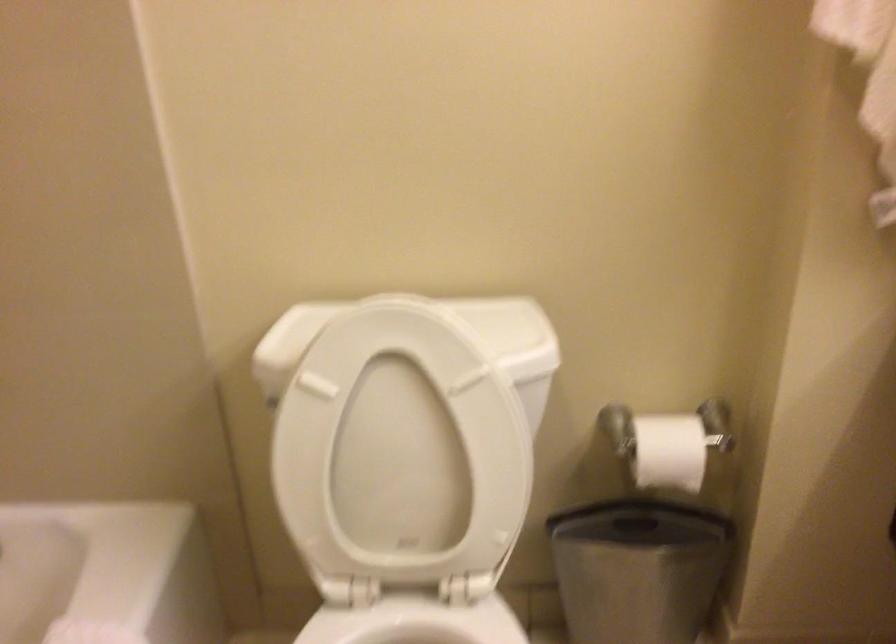
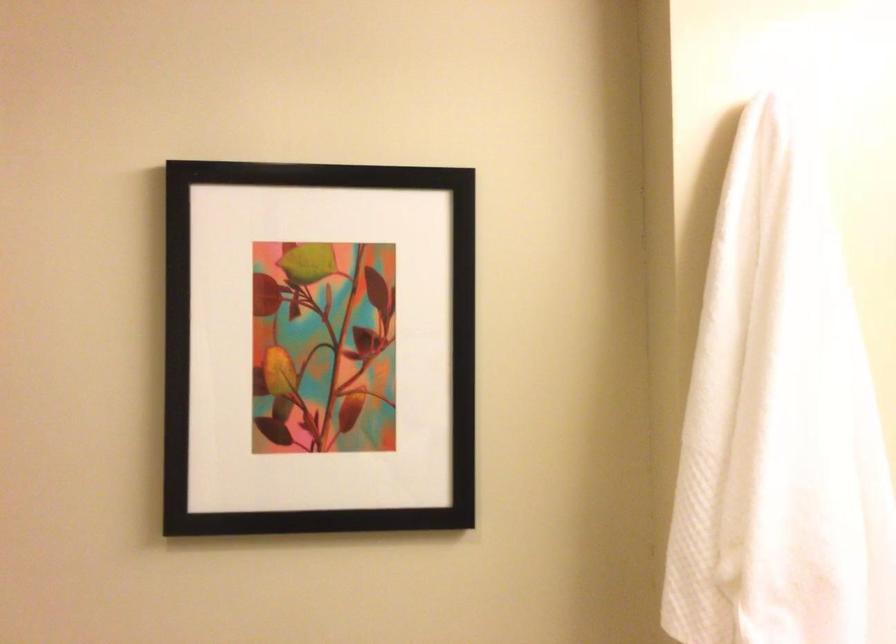
Which direction would the cameraman need to move to produce the second image?

The cameraman moved toward right, backward.